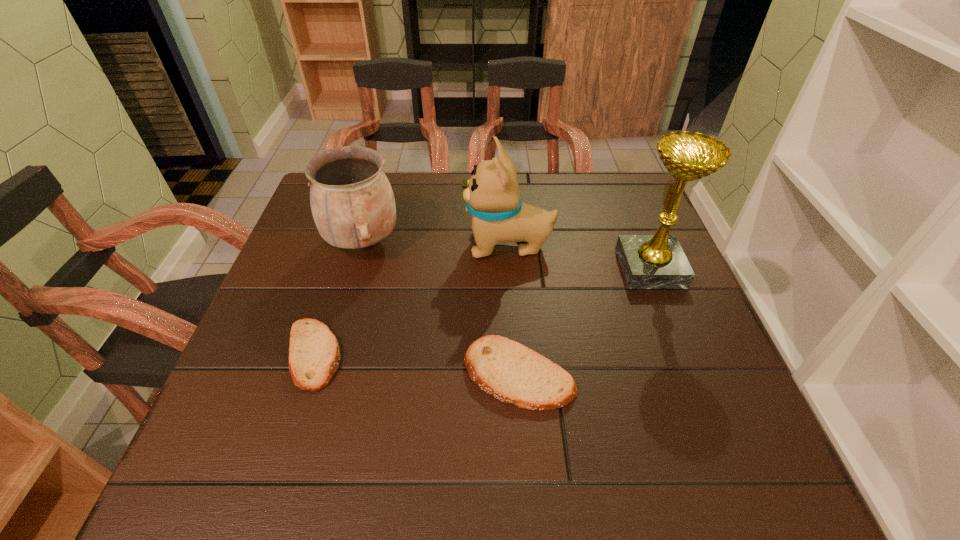
Find the location of a particular element. vacant space located on the front-facing side of the rightmost object is located at coordinates (584, 268).

Locate an element on the screen. The image size is (960, 540). free region located 0.090m on the front-facing side of the rightmost object is located at coordinates (584, 268).

In order to click on vacant space positioned on the front-facing side of the rightmost object in this screenshot , I will do `click(538, 268)`.

At what (x,y) coordinates should I click in order to perform the action: click on vacant space situated 0.130m on the face of the fourth shortest object. Please return your answer as a coordinate pair (x, y). The height and width of the screenshot is (540, 960). Looking at the image, I should click on pyautogui.click(x=413, y=245).

This screenshot has height=540, width=960. Find the location of `vacant region located on the face of the fourth shortest object`. vacant region located on the face of the fourth shortest object is located at coordinates (432, 245).

At what (x,y) coordinates should I click in order to perform the action: click on vacant position located 0.180m on the face of the fourth shortest object. Please return your answer as a coordinate pair (x, y). Looking at the image, I should click on (393, 245).

This screenshot has height=540, width=960. What are the coordinates of `object situated at the far edge` in the screenshot? It's located at (352, 202).

Where is `pita bread at the left edge`? The width and height of the screenshot is (960, 540). pita bread at the left edge is located at coordinates (314, 355).

Find the location of `urn that is at the left edge`. urn that is at the left edge is located at coordinates (352, 202).

Locate an element on the screen. This screenshot has height=540, width=960. object that is at the right edge is located at coordinates (658, 261).